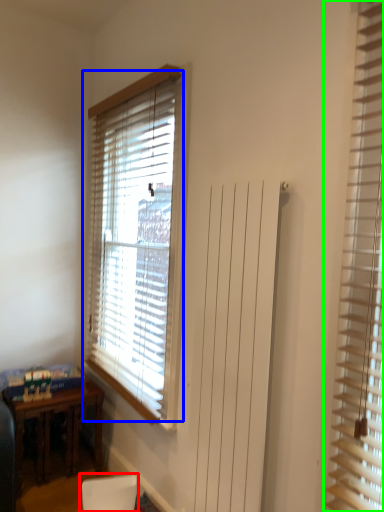
Question: Which object is the farthest from armchair (highlighted by a red box)? Choose among these: window blind (highlighted by a blue box) or window blind (highlighted by a green box).

Choices:
 (A) window blind
 (B) window blind

Answer: (B)